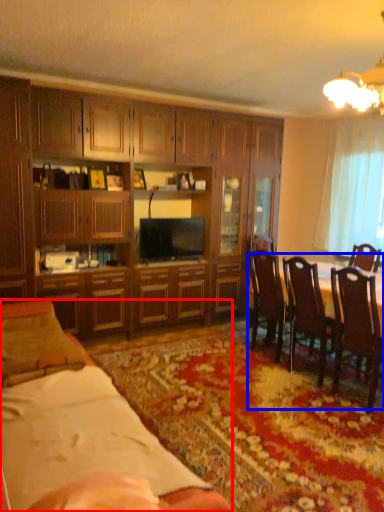
Question: Among these objects, which one is nearest to the camera, desk (highlighted by a red box) or kitchen & dining room table (highlighted by a blue box)?

Choices:
 (A) desk
 (B) kitchen & dining room table

Answer: (A)